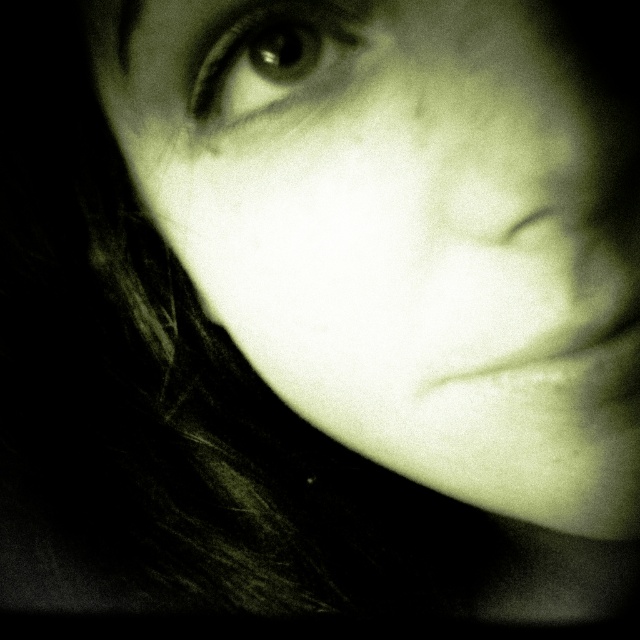
You are an artist trying to paint this portrait. The matte skin face at center and the shiny black eye at upper left are crucial for the composition. If your canvas is 10 centimeters wide, can you fit both elements without overlapping?

The matte skin face at center is 5.61 centimeters from the shiny black eye at upper left. Since the distance between them is less than the canvas width of 10 centimeters, both elements can fit on the canvas without overlapping.